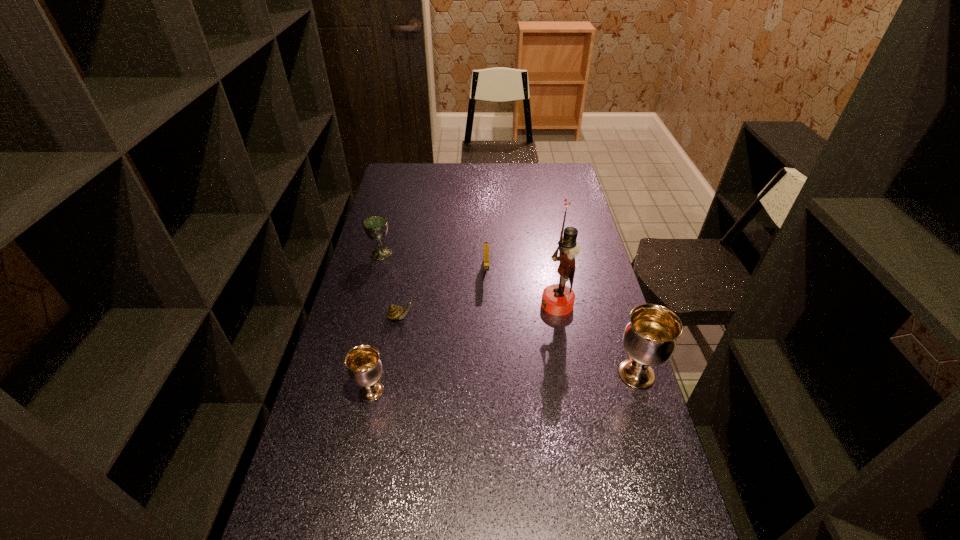
Find the location of a particular element. This screenshot has height=540, width=960. the tallest chalice is located at coordinates (649, 339).

Find the location of a particular element. The width and height of the screenshot is (960, 540). the second tallest object is located at coordinates (649, 339).

Where is `nutcracker`? nutcracker is located at coordinates (557, 299).

Find the location of a particular element. the tallest object is located at coordinates (557, 299).

Locate an element on the screen. This screenshot has width=960, height=540. snail is located at coordinates (394, 312).

Image resolution: width=960 pixels, height=540 pixels. In order to click on the fourth object from left to right in this screenshot , I will do `click(486, 246)`.

Identify the location of the farthest chalice. (376, 227).

Locate an element on the screen. The height and width of the screenshot is (540, 960). free region located 0.350m on the front of the tallest chalice is located at coordinates (685, 530).

The height and width of the screenshot is (540, 960). Find the location of `free space located on the front-facing side of the fifth object from left to right`. free space located on the front-facing side of the fifth object from left to right is located at coordinates (486, 304).

This screenshot has height=540, width=960. What are the coordinates of `free space located on the front-facing side of the fifth object from left to right` in the screenshot? It's located at (474, 304).